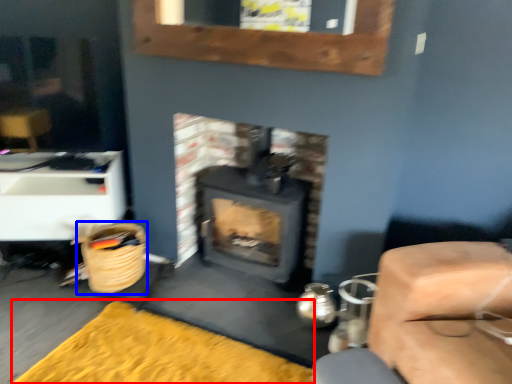
Question: Which of the following is the farthest to the observer, doormat (highlighted by a red box) or basket (highlighted by a blue box)?

Choices:
 (A) doormat
 (B) basket

Answer: (B)